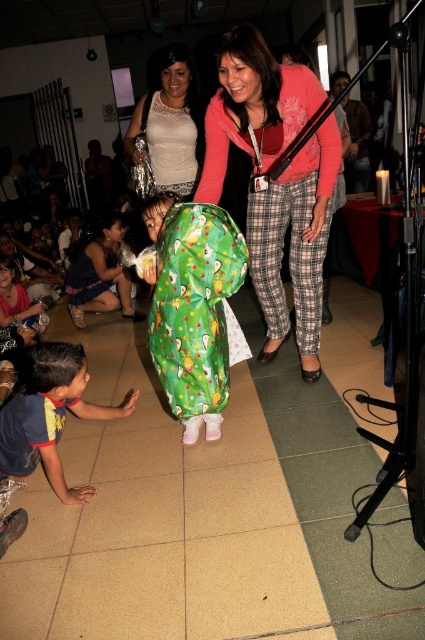
Looking at the scene, where is the pink soft sweater at center in relation to the matte white blouse at upper center?

The pink soft sweater at center is to the right of the matte white blouse at upper center.

Consider the image. You are a photographer at the event and want to capture a photo of the pink soft sweater at center without any obstruction. Given that the green shiny wrapping paper at center is in the way, can you adjust your position to take the photo?

The green shiny wrapping paper at center is behind the pink soft sweater at center, so you can move to a position where the pink soft sweater at center is in front and the green shiny wrapping paper at center is no longer blocking the view.

You are a photographer standing in the scene. You want to take a photo of the blue cotton shirt at lower left without moving any objects. Can you capture it in your current position?

The blue cotton shirt at lower left is 2.05 meters from viewer, so yes, you can capture it in your current position as it is within a reasonable distance for photography.